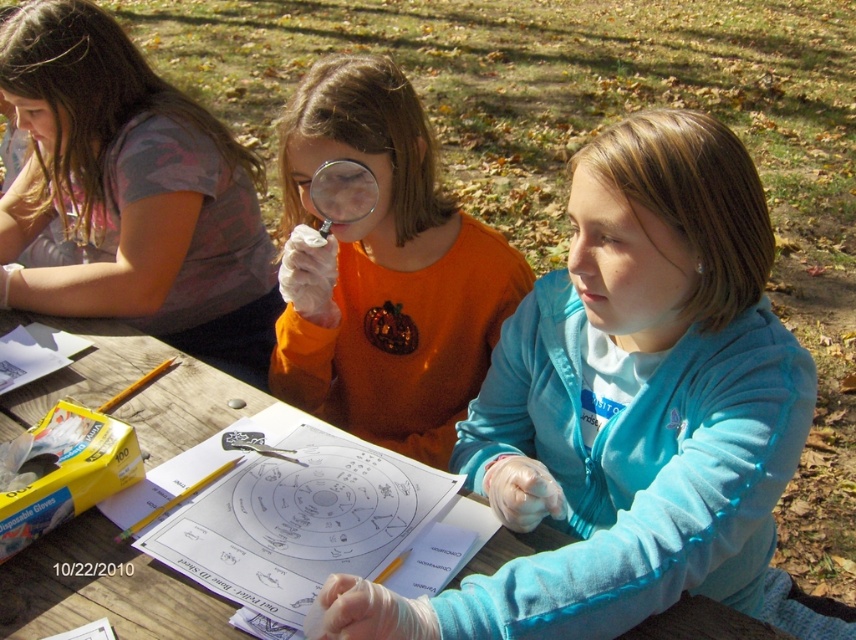
Does blue fleece jacket at center have a smaller size compared to transparent plastic magnifying glass at center?

No, blue fleece jacket at center is not smaller than transparent plastic magnifying glass at center.

Does blue fleece jacket at center appear on the left side of transparent plastic magnifying glass at center?

In fact, blue fleece jacket at center is to the right of transparent plastic magnifying glass at center.

Find the location of a particular element. The image size is (856, 640). blue fleece jacket at center is located at coordinates (627, 404).

Between orange sequined shirt at center and wooden table at center, which one appears on the left side from the viewer's perspective?

wooden table at center is more to the left.

Between orange sequined shirt at center and wooden table at center, which one is positioned lower?

wooden table at center is lower down.

Between point (476, 385) and point (194, 582), which one is positioned in front?

Point (194, 582)

You are a GUI agent. You are given a task and a screenshot of the screen. Output one action in this format:
    pyautogui.click(x=<x>, y=<y>)
    Task: Click on the orange sequined shirt at center
    The image size is (856, 640).
    Given the screenshot: What is the action you would take?
    pyautogui.click(x=383, y=272)

Can you confirm if blue fleece jacket at center is positioned to the right of wooden table at center?

Indeed, blue fleece jacket at center is positioned on the right side of wooden table at center.

Is blue fleece jacket at center shorter than wooden table at center?

No.

Locate an element on the screen. blue fleece jacket at center is located at coordinates (627, 404).

Where is `blue fleece jacket at center`? blue fleece jacket at center is located at coordinates (627, 404).